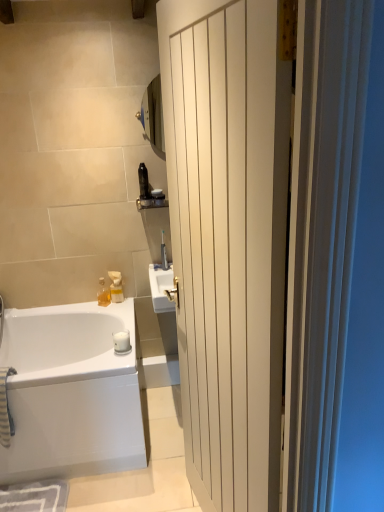
Question: Is translucent plastic soap dispenser at upper center, placed as the 3th toiletry when sorted from top to bottom, far from white glossy bathtub at lower left?

Choices:
 (A) no
 (B) yes

Answer: (A)

Question: Is translucent plastic soap dispenser at upper center, which appears as the second toiletry when viewed from the left, facing towards white glossy bathtub at lower left?

Choices:
 (A) no
 (B) yes

Answer: (A)

Question: Can you confirm if translucent plastic soap dispenser at upper center, which is counted as the second toiletry, starting from the bottom, is smaller than white glossy bathtub at lower left?

Choices:
 (A) yes
 (B) no

Answer: (A)

Question: Is translucent plastic soap dispenser at upper center, which appears as the second toiletry when viewed from the left, positioned with its back to white glossy bathtub at lower left?

Choices:
 (A) no
 (B) yes

Answer: (A)

Question: Is translucent plastic soap dispenser at upper center, which is counted as the second toiletry, starting from the bottom, not inside white glossy bathtub at lower left?

Choices:
 (A) yes
 (B) no

Answer: (A)

Question: Considering the relative sizes of translucent plastic soap dispenser at upper center, which appears as the second toiletry when viewed from the left, and white glossy bathtub at lower left in the image provided, is translucent plastic soap dispenser at upper center, which appears as the second toiletry when viewed from the left, wider than white glossy bathtub at lower left?

Choices:
 (A) yes
 (B) no

Answer: (B)

Question: Is matte black toothbrush at upper center, arranged as the fourth toiletry when viewed from the left, outside translucent plastic soap dispenser at upper center, the 3th toiletry from the right?

Choices:
 (A) yes
 (B) no

Answer: (A)

Question: From the image's perspective, would you say matte black toothbrush at upper center, the 1th toiletry viewed from the right, is shown under translucent plastic soap dispenser at upper center, which is counted as the second toiletry, starting from the bottom?

Choices:
 (A) yes
 (B) no

Answer: (B)

Question: Considering the relative sizes of matte black toothbrush at upper center, arranged as the fourth toiletry when viewed from the left, and translucent plastic soap dispenser at upper center, which appears as the second toiletry when viewed from the left, in the image provided, is matte black toothbrush at upper center, arranged as the fourth toiletry when viewed from the left, wider than translucent plastic soap dispenser at upper center, which appears as the second toiletry when viewed from the left,?

Choices:
 (A) yes
 (B) no

Answer: (A)

Question: Is matte black toothbrush at upper center, the 1th toiletry viewed from the right, next to translucent plastic soap dispenser at upper center, which is counted as the second toiletry, starting from the bottom?

Choices:
 (A) yes
 (B) no

Answer: (B)

Question: Is matte black toothbrush at upper center, the 1th toiletry viewed from the right, thinner than translucent plastic soap dispenser at upper center, placed as the 3th toiletry when sorted from top to bottom?

Choices:
 (A) no
 (B) yes

Answer: (A)

Question: Can you confirm if matte black toothbrush at upper center, the 1th toiletry viewed from the right, is positioned to the right of translucent plastic soap dispenser at upper center, which appears as the second toiletry when viewed from the left?

Choices:
 (A) yes
 (B) no

Answer: (A)

Question: Considering the relative sizes of satin nickel faucet at upper center and black plastic bottle at upper center, which ranks as the first toiletry in top-to-bottom order, in the image provided, is satin nickel faucet at upper center taller than black plastic bottle at upper center, which ranks as the first toiletry in top-to-bottom order,?

Choices:
 (A) no
 (B) yes

Answer: (B)